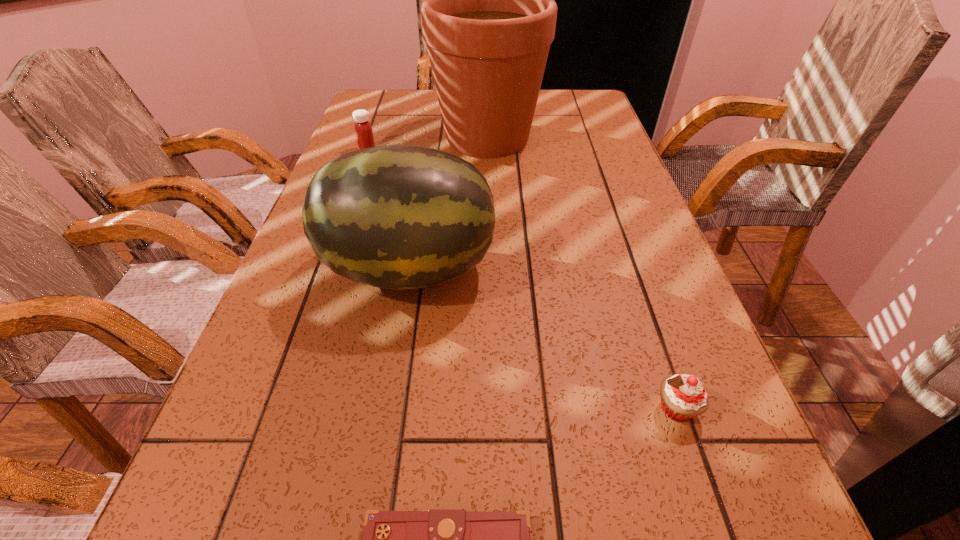
This screenshot has width=960, height=540. In order to click on object that can be found as the third closest to the medicine in this screenshot , I will do `click(683, 396)`.

At what (x,y) coordinates should I click in order to perform the action: click on object that is the nearest to the medicine. Please return your answer as a coordinate pair (x, y). Looking at the image, I should click on (488, 13).